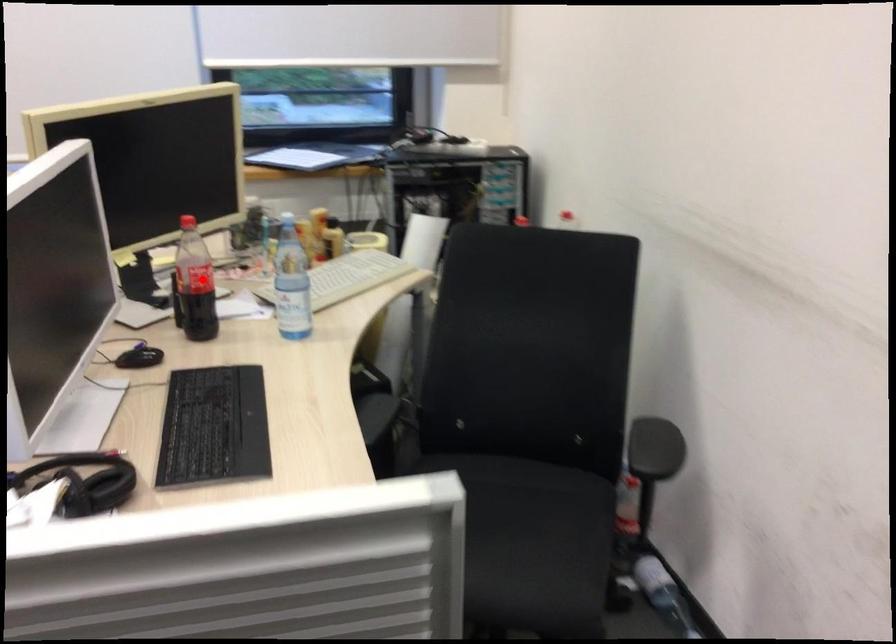
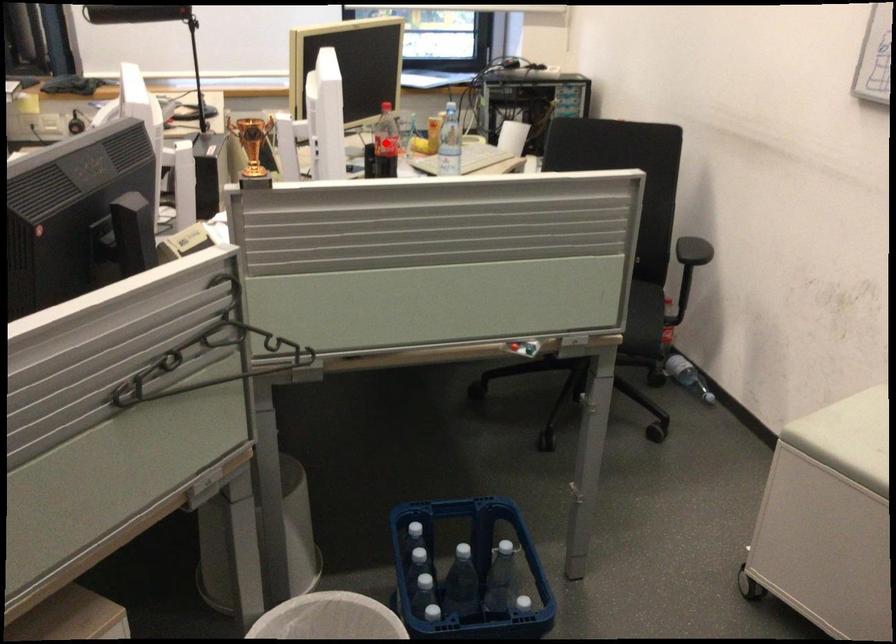
Based on the photo, I am providing you with two images of the same scene from different viewpoints. A red point is marked on the first image and another point is marked on the second image. Is the marked point in image1 the same physical position as the marked point in image2?

Yes